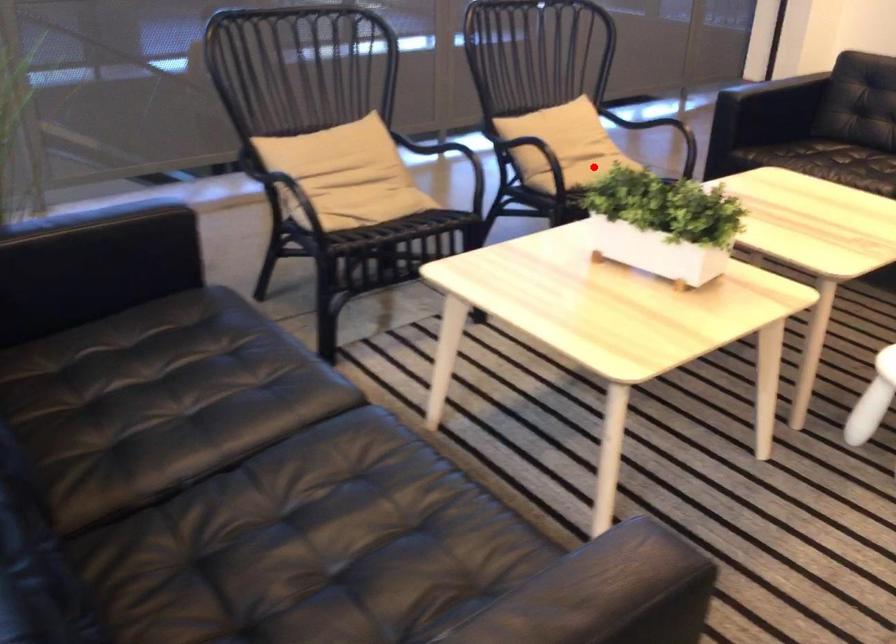
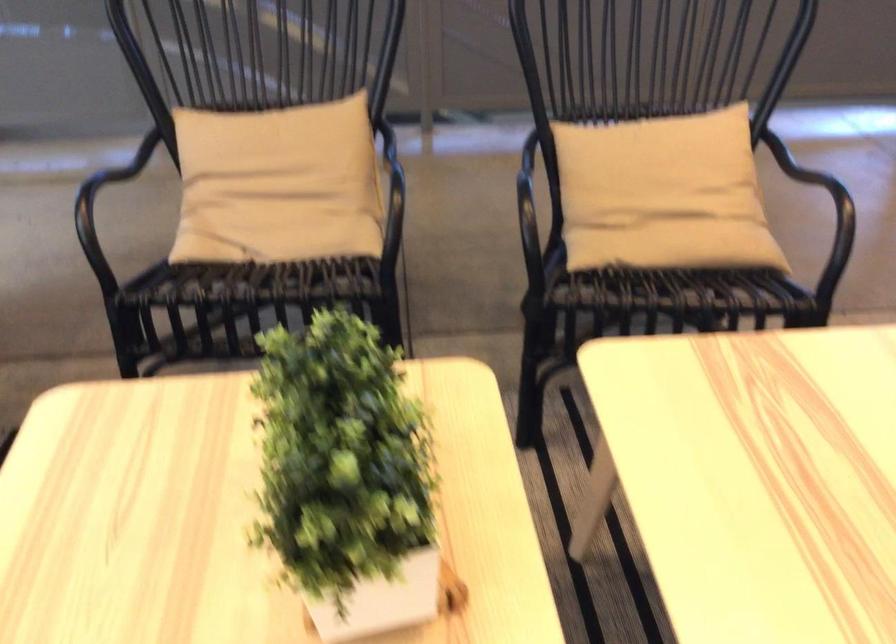
Question: I am providing you with two images of the same scene from different viewpoints. A red point is shown in image1. For the corresponding object point in image2, is it positioned nearer or farther from the camera?

Choices:
 (A) Nearer
 (B) Farther

Answer: (A)